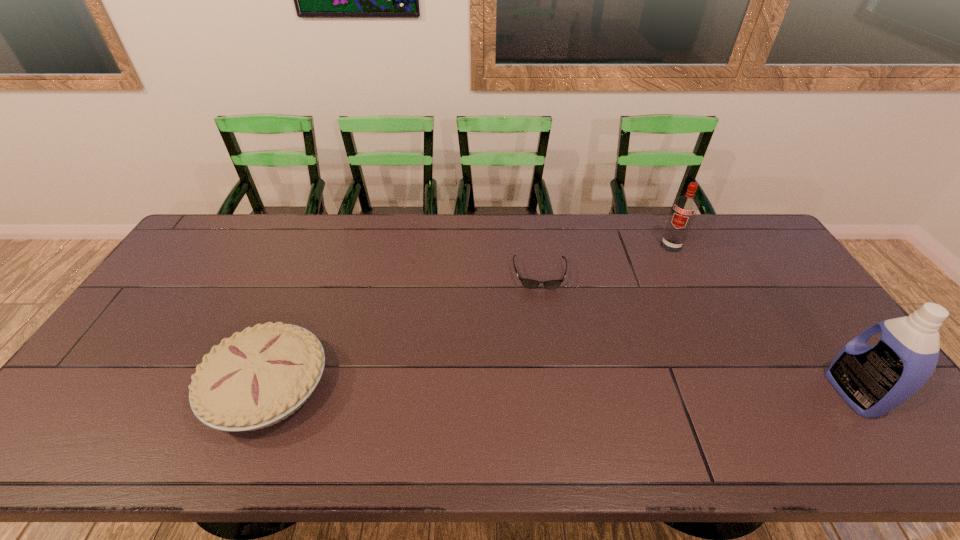
Where is `free space located 0.310m on the front label of the farthest object`? free space located 0.310m on the front label of the farthest object is located at coordinates (635, 307).

Identify the location of vacant space situated on the front label of the farthest object. The width and height of the screenshot is (960, 540). (623, 326).

You are a GUI agent. You are given a task and a screenshot of the screen. Output one action in this format:
    pyautogui.click(x=<x>, y=<y>)
    Task: Click on the free space located 0.090m on the front label of the farthest object
    
    Given the screenshot: What is the action you would take?
    pyautogui.click(x=659, y=266)

Where is `free space located 0.240m on the front-facing side of the third object from right to left`? The image size is (960, 540). free space located 0.240m on the front-facing side of the third object from right to left is located at coordinates (545, 354).

What are the coordinates of `blank area located on the front-facing side of the third object from right to left` in the screenshot? It's located at (541, 305).

You are a GUI agent. You are given a task and a screenshot of the screen. Output one action in this format:
    pyautogui.click(x=<x>, y=<y>)
    Task: Click on the free space located on the front-facing side of the third object from right to left
    The width and height of the screenshot is (960, 540).
    Given the screenshot: What is the action you would take?
    pyautogui.click(x=543, y=334)

Locate an element on the screen. The width and height of the screenshot is (960, 540). object that is positioned at the far edge is located at coordinates (684, 209).

Identify the location of pie present at the near edge. (256, 378).

In order to click on detergent located at the near edge in this screenshot , I will do `click(873, 380)`.

Where is `object that is at the right edge`? Image resolution: width=960 pixels, height=540 pixels. object that is at the right edge is located at coordinates (873, 380).